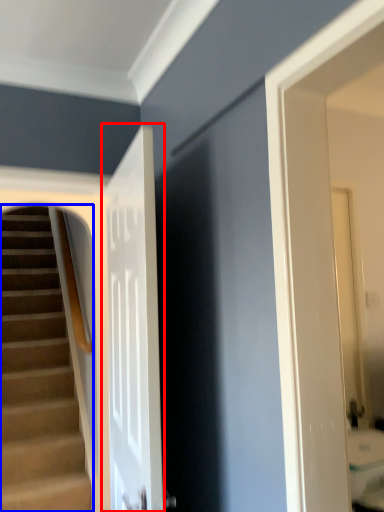
Question: Among these objects, which one is farthest to the camera, door (highlighted by a red box) or stairs (highlighted by a blue box)?

Choices:
 (A) door
 (B) stairs

Answer: (B)